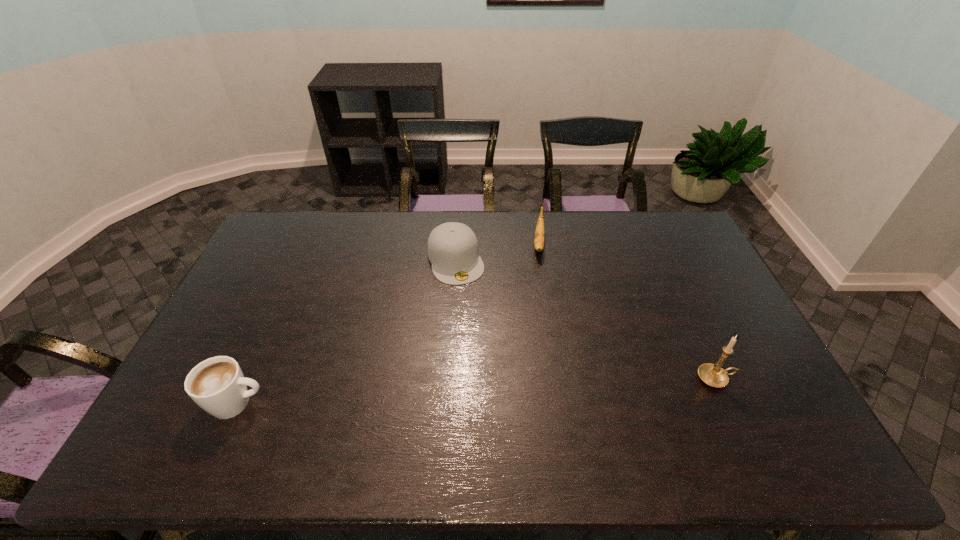
Identify the location of free location located 0.140m on the front-facing side of the second object from left to right. (473, 314).

The width and height of the screenshot is (960, 540). In order to click on vacant area situated on the front-facing side of the second object from left to right in this screenshot , I will do `click(478, 329)`.

Where is `free point located 0.220m on the front-facing side of the second object from left to right`? free point located 0.220m on the front-facing side of the second object from left to right is located at coordinates (480, 334).

What are the coordinates of `banana at the far edge` in the screenshot? It's located at [539, 233].

This screenshot has height=540, width=960. I want to click on cap that is at the far edge, so click(x=453, y=251).

Identify the location of object at the near edge. (217, 385).

Find the location of a particular element. This screenshot has height=540, width=960. object situated at the left edge is located at coordinates (217, 385).

What are the coordinates of `object positioned at the right edge` in the screenshot? It's located at (713, 375).

The width and height of the screenshot is (960, 540). I want to click on object present at the near left corner, so click(217, 385).

Locate an element on the screen. The image size is (960, 540). vacant region at the far edge of the desktop is located at coordinates (545, 228).